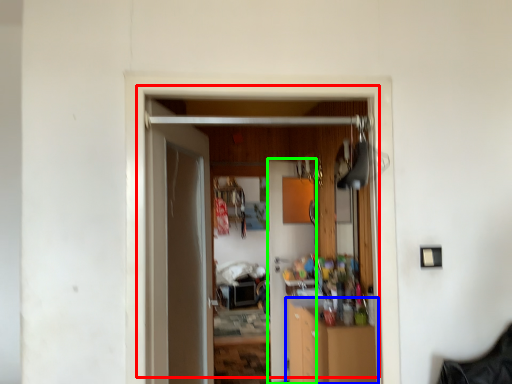
Question: Considering the real-world distances, which object is closest to door (highlighted by a red box)? cabinetry (highlighted by a blue box) or door (highlighted by a green box).

Choices:
 (A) cabinetry
 (B) door

Answer: (A)